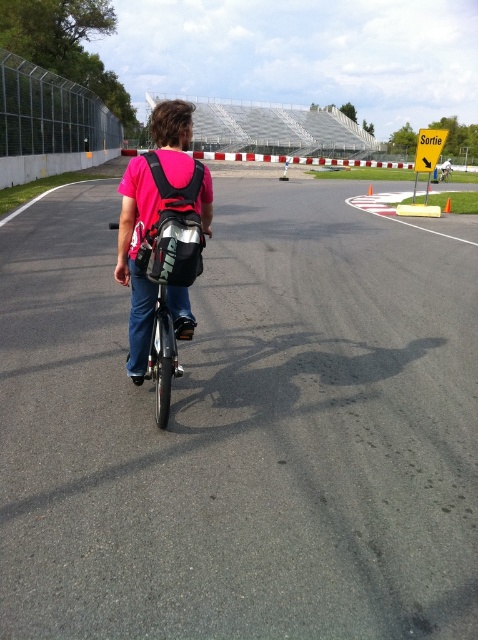
Can you confirm if pink fabric shirt at center is positioned to the left of orange plastic cone at center?

Correct, you'll find pink fabric shirt at center to the left of orange plastic cone at center.

Does pink fabric shirt at center appear on the right side of orange plastic cone at center?

In fact, pink fabric shirt at center is to the left of orange plastic cone at center.

Is point (131, 209) behind point (446, 205)?

No, (131, 209) is in front of (446, 205).

You are a GUI agent. You are given a task and a screenshot of the screen. Output one action in this format:
    pyautogui.click(x=<x>, y=<y>)
    Task: Click on the pink fabric shirt at center
    This screenshot has height=640, width=478.
    Given the screenshot: What is the action you would take?
    (x=134, y=259)

Does black fabric backpack at center come in front of shiny metallic bicycle at center?

That is True.

Consider the image. Who is lower down, black fabric backpack at center or shiny metallic bicycle at center?

shiny metallic bicycle at center is below.

Between point (156, 225) and point (164, 344), which one is positioned behind?

Positioned behind is point (164, 344).

Identify the location of black fabric backpack at center. The width and height of the screenshot is (478, 640). (173, 227).

Who is lower down, pink fabric shirt at center or shiny metallic bicycle at center?

shiny metallic bicycle at center is below.

Does pink fabric shirt at center have a greater width compared to shiny metallic bicycle at center?

Yes, pink fabric shirt at center is wider than shiny metallic bicycle at center.

Describe the element at coordinates (134, 259) in the screenshot. I see `pink fabric shirt at center` at that location.

What are the coordinates of `pink fabric shirt at center` in the screenshot? It's located at (x=134, y=259).